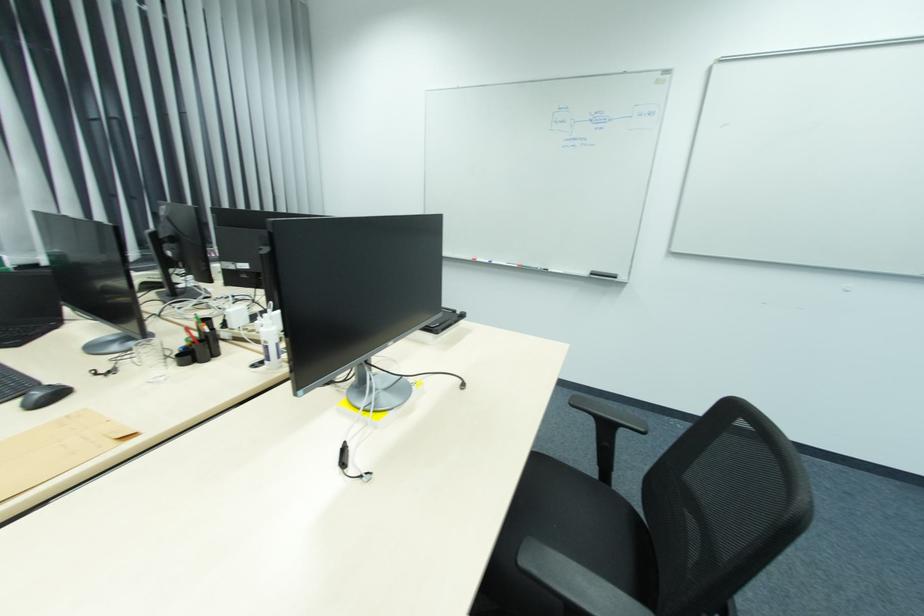
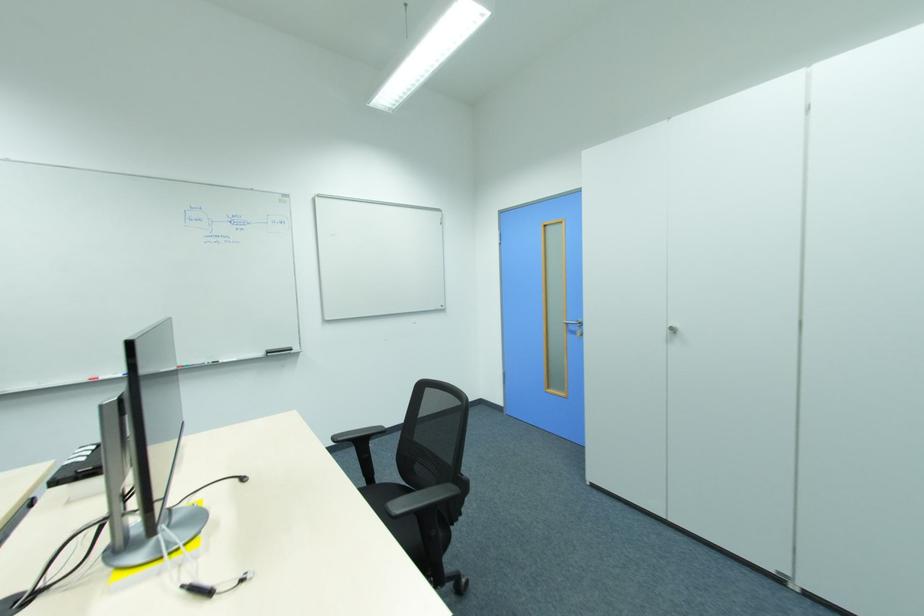
Question: How did the camera likely rotate?

Choices:
 (A) Left
 (B) Right
 (C) Up
 (D) Down

Answer: (B)